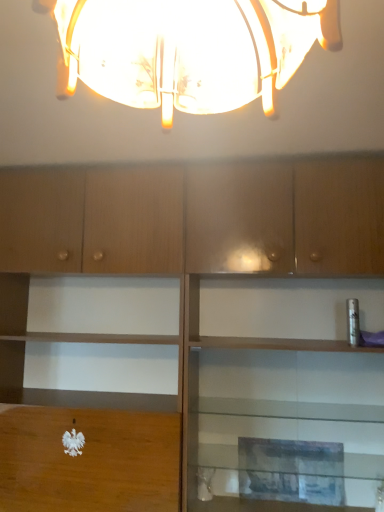
Question: Should I look upward or downward to see translucent glass lampshade at upper center?

Choices:
 (A) down
 (B) up

Answer: (B)

Question: Is translucent glass lampshade at upper center bigger than wooden cabinet at center?

Choices:
 (A) yes
 (B) no

Answer: (B)

Question: Is translucent glass lampshade at upper center outside of wooden cabinet at center?

Choices:
 (A) yes
 (B) no

Answer: (A)

Question: From a real-world perspective, does translucent glass lampshade at upper center sit lower than wooden cabinet at center?

Choices:
 (A) yes
 (B) no

Answer: (B)

Question: Considering the relative positions of translucent glass lampshade at upper center and wooden cabinet at center in the image provided, is translucent glass lampshade at upper center to the right of wooden cabinet at center from the viewer's perspective?

Choices:
 (A) no
 (B) yes

Answer: (A)

Question: Is the position of translucent glass lampshade at upper center more distant than that of wooden cabinet at center?

Choices:
 (A) yes
 (B) no

Answer: (B)

Question: Is wooden cabinet at center completely or partially inside translucent glass lampshade at upper center?

Choices:
 (A) no
 (B) yes

Answer: (A)

Question: Is wooden cabinet at center with translucent glass lampshade at upper center?

Choices:
 (A) yes
 (B) no

Answer: (B)

Question: Does wooden cabinet at center turn towards translucent glass lampshade at upper center?

Choices:
 (A) yes
 (B) no

Answer: (A)

Question: Is translucent glass lampshade at upper center a part of wooden cabinet at center?

Choices:
 (A) no
 (B) yes

Answer: (A)

Question: Is wooden cabinet at center at the right side of translucent glass lampshade at upper center?

Choices:
 (A) no
 (B) yes

Answer: (B)

Question: Is wooden cabinet at center completely or partially outside of translucent glass lampshade at upper center?

Choices:
 (A) yes
 (B) no

Answer: (A)

Question: Is wooden cabinet at center oriented away from translucent glass lampshade at upper center?

Choices:
 (A) yes
 (B) no

Answer: (B)

Question: From a real-world perspective, is translucent glass lampshade at upper center physically located above or below wooden cabinet at center?

Choices:
 (A) above
 (B) below

Answer: (A)